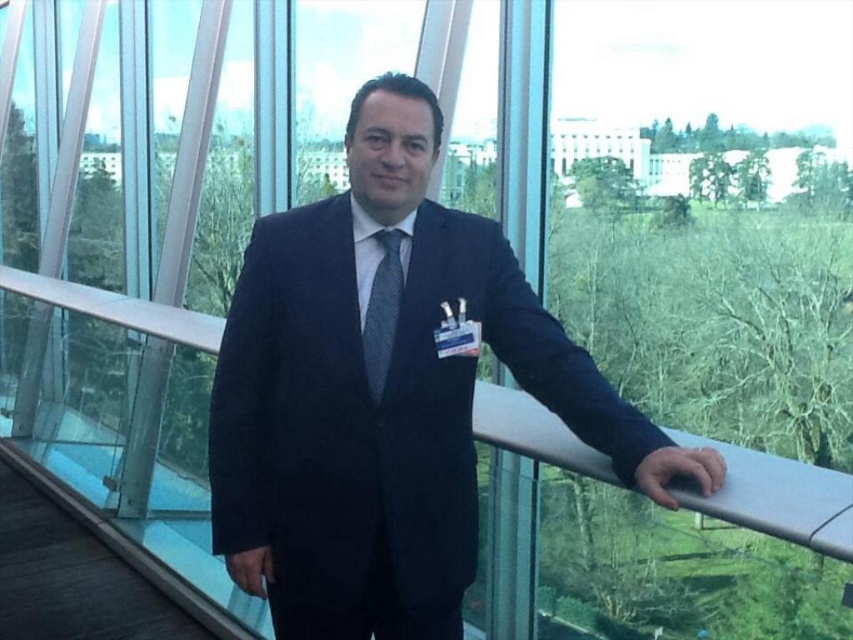
Is navy blue suit at center further to camera compared to matte gray tie at center?

That is False.

Does navy blue suit at center come in front of matte gray tie at center?

Yes.

Does point (643, 488) come closer to viewer compared to point (402, 284)?

Yes, it is.

Locate an element on the screen. The image size is (853, 640). navy blue suit at center is located at coordinates (386, 396).